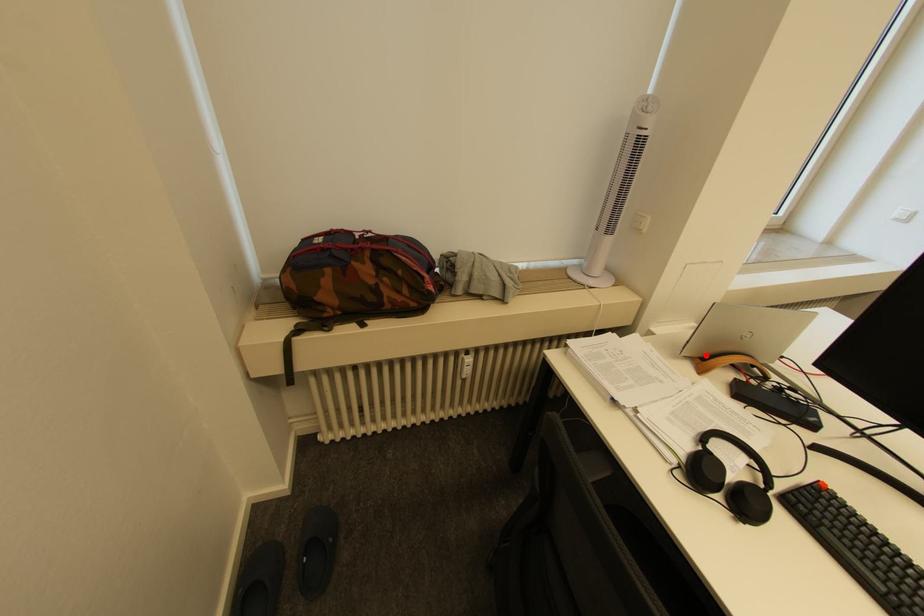
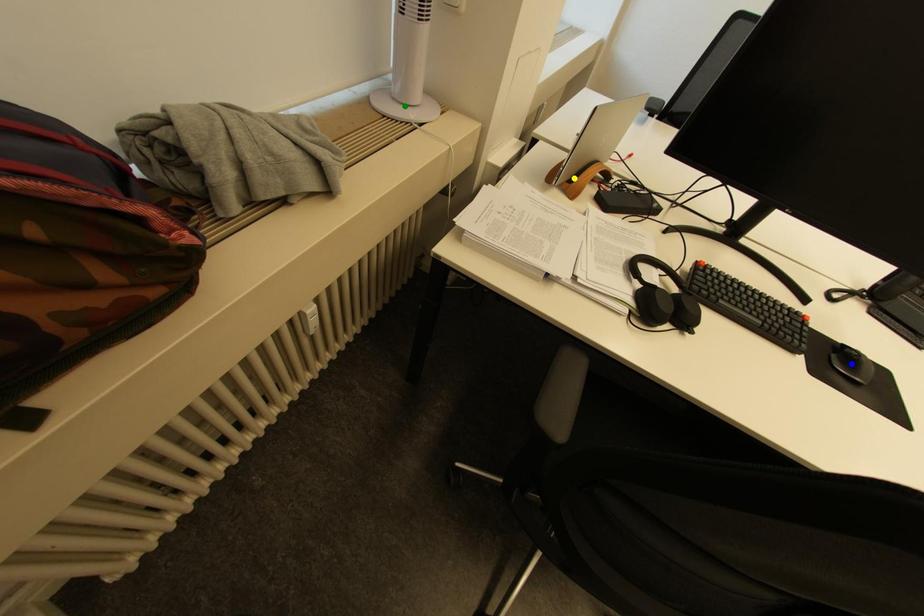
Question: I am providing you with two images of the same scene from different viewpoints. A red point is marked on the first image. You are given multiple points on the second image. Which mark in image 2 goes with the point in image 1?

Choices:
 (A) blue point
 (B) green point
 (C) yellow point

Answer: (C)